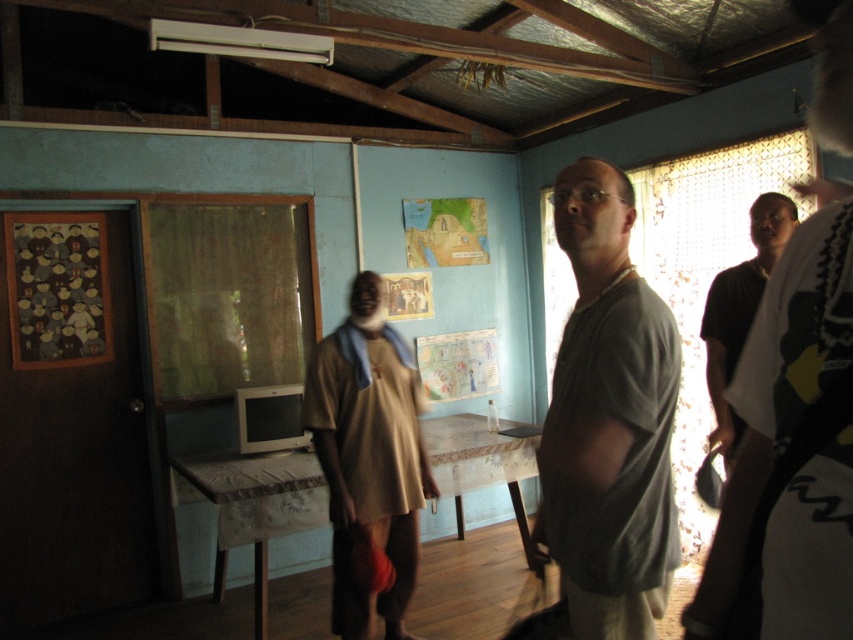
Who is taller, gray matte shirt at center or dark brown shirt at right?

dark brown shirt at right is taller.

Is gray matte shirt at center positioned at the back of dark brown shirt at right?

No, it is in front of dark brown shirt at right.

Between point (585, 524) and point (718, 374), which one is positioned in front?

Positioned in front is point (585, 524).

Find the location of a particular element. The image size is (853, 640). gray matte shirt at center is located at coordinates [x=608, y=420].

Between gray matte shirt at center and brown fabric dress at center, which one appears on the right side from the viewer's perspective?

From the viewer's perspective, gray matte shirt at center appears more on the right side.

Who is positioned more to the left, gray matte shirt at center or brown fabric dress at center?

brown fabric dress at center is more to the left.

Does point (550, 483) come farther from viewer compared to point (386, 372)?

No, (550, 483) is closer to viewer.

Find the location of a particular element. The width and height of the screenshot is (853, 640). gray matte shirt at center is located at coordinates (608, 420).

Is brown fabric dress at center above dark brown shirt at right?

No, brown fabric dress at center is not above dark brown shirt at right.

Does brown fabric dress at center have a smaller size compared to dark brown shirt at right?

No.

Does point (357, 376) lie in front of point (773, 211)?

That is False.

At what (x,y) coordinates should I click in order to perform the action: click on brown fabric dress at center. Please return your answer as a coordinate pair (x, y). This screenshot has width=853, height=640. Looking at the image, I should click on (368, 460).